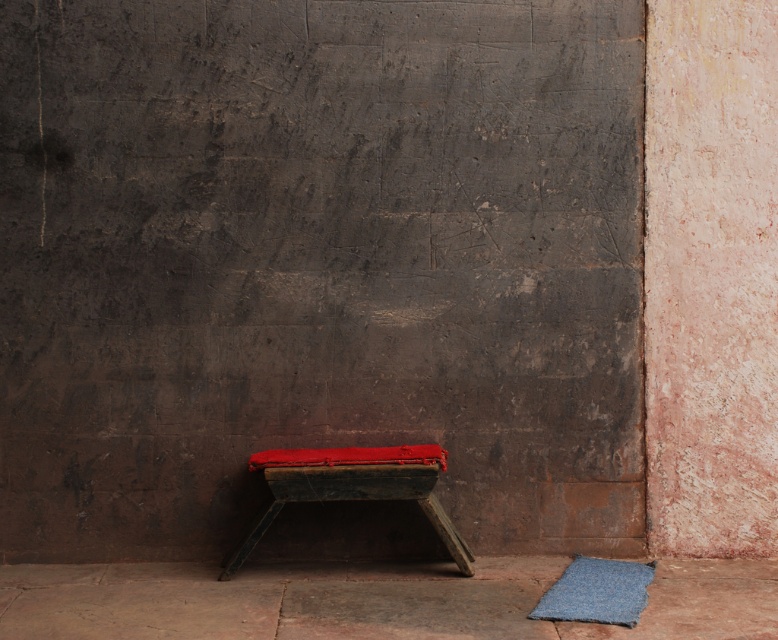
Question: Among these objects, which one is farthest from the camera?

Choices:
 (A) red leather stool at center
 (B) blue felt mat at lower right

Answer: (A)

Question: Does red leather stool at center appear on the left side of blue felt mat at lower right?

Choices:
 (A) no
 (B) yes

Answer: (B)

Question: Does red leather stool at center lie behind blue felt mat at lower right?

Choices:
 (A) yes
 (B) no

Answer: (A)

Question: Can you confirm if red leather stool at center is positioned below blue felt mat at lower right?

Choices:
 (A) no
 (B) yes

Answer: (A)

Question: Which object is farther from the camera taking this photo?

Choices:
 (A) red leather stool at center
 (B) blue felt mat at lower right

Answer: (A)